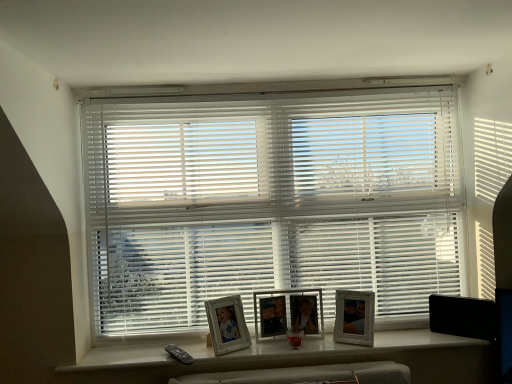
Question: Which direction should I rotate to face white wooden picture frame at center, which is the first picture frame in left-to-right order, — up or down?

Choices:
 (A) down
 (B) up

Answer: (A)

Question: Is white plastic blinds at center shorter than white wooden picture frame at center, which is the first picture frame in left-to-right order?

Choices:
 (A) no
 (B) yes

Answer: (A)

Question: Does white plastic blinds at center turn towards white wooden picture frame at center, which is the first picture frame in left-to-right order?

Choices:
 (A) yes
 (B) no

Answer: (A)

Question: Can you confirm if white plastic blinds at center is positioned to the right of white wooden picture frame at center, which is the first picture frame in left-to-right order?

Choices:
 (A) no
 (B) yes

Answer: (B)

Question: Is white plastic blinds at center facing away from white wooden picture frame at center, which is the first picture frame in left-to-right order?

Choices:
 (A) no
 (B) yes

Answer: (B)

Question: Does white plastic blinds at center have a larger size compared to white wooden picture frame at center, the 3th picture frame in the right-to-left sequence?

Choices:
 (A) yes
 (B) no

Answer: (A)

Question: Can you confirm if white plastic blinds at center is smaller than white wooden picture frame at center, the 3th picture frame in the right-to-left sequence?

Choices:
 (A) yes
 (B) no

Answer: (B)

Question: Does white wooden picture frame at center, which is the first picture frame in left-to-right order, have a lesser width compared to white glossy picture frame at center, arranged as the 1th picture frame when viewed from the right?

Choices:
 (A) yes
 (B) no

Answer: (B)

Question: Considering the relative sizes of white wooden picture frame at center, the 3th picture frame in the right-to-left sequence, and white glossy picture frame at center, marked as the third picture frame in a left-to-right arrangement, in the image provided, is white wooden picture frame at center, the 3th picture frame in the right-to-left sequence, smaller than white glossy picture frame at center, marked as the third picture frame in a left-to-right arrangement,?

Choices:
 (A) yes
 (B) no

Answer: (B)

Question: Does white wooden picture frame at center, the 3th picture frame in the right-to-left sequence, have a greater width compared to white glossy picture frame at center, marked as the third picture frame in a left-to-right arrangement?

Choices:
 (A) no
 (B) yes

Answer: (B)

Question: From the image's perspective, is white wooden picture frame at center, which is the first picture frame in left-to-right order, under white glossy picture frame at center, marked as the third picture frame in a left-to-right arrangement?

Choices:
 (A) no
 (B) yes

Answer: (B)

Question: Is white wooden picture frame at center, which is the first picture frame in left-to-right order, further to the viewer compared to white glossy picture frame at center, arranged as the 1th picture frame when viewed from the right?

Choices:
 (A) no
 (B) yes

Answer: (A)

Question: Is white wooden picture frame at center, the 3th picture frame in the right-to-left sequence, to the left of white glossy picture frame at center, marked as the third picture frame in a left-to-right arrangement, from the viewer's perspective?

Choices:
 (A) no
 (B) yes

Answer: (B)

Question: Is white plastic frames at center surrounded by white glossy picture frame at center, marked as the third picture frame in a left-to-right arrangement?

Choices:
 (A) yes
 (B) no

Answer: (B)